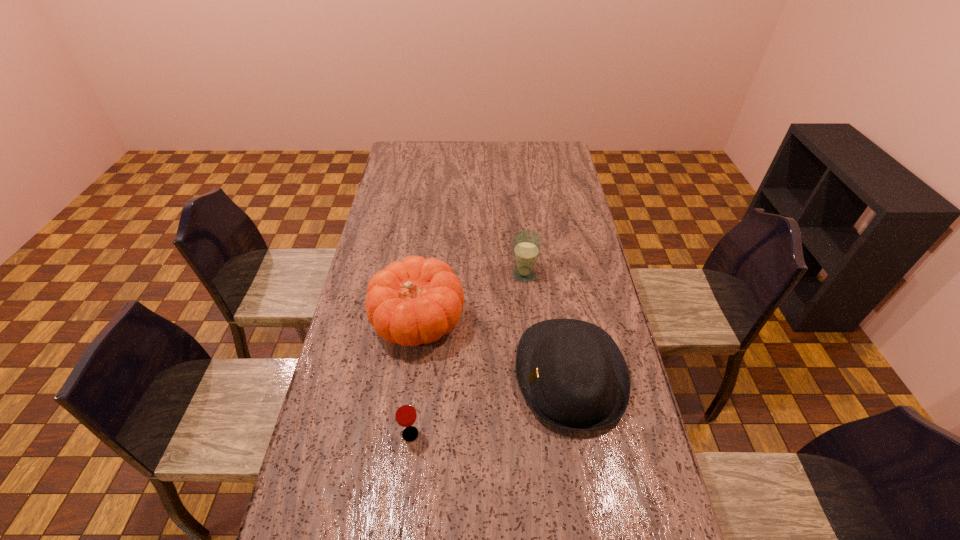
The width and height of the screenshot is (960, 540). Identify the location of the tallest object. tap(417, 301).

Locate an element on the screen. The width and height of the screenshot is (960, 540). the farther glass is located at coordinates (526, 244).

I want to click on the right glass, so click(x=526, y=244).

Find the location of a particular element. The height and width of the screenshot is (540, 960). fedora is located at coordinates (572, 374).

Where is `the nearer glass`? The image size is (960, 540). the nearer glass is located at coordinates [405, 413].

Where is `the shorter glass`? This screenshot has width=960, height=540. the shorter glass is located at coordinates (405, 413).

Where is `vacant space located 0.380m on the right of the tallest object`? The image size is (960, 540). vacant space located 0.380m on the right of the tallest object is located at coordinates (582, 322).

At what (x,y) coordinates should I click in order to perform the action: click on free space located on the back of the farther glass. Please return your answer as a coordinate pair (x, y). Looking at the image, I should click on (522, 252).

Image resolution: width=960 pixels, height=540 pixels. Identify the location of free spot located on the front-facing side of the fedora. (430, 375).

Image resolution: width=960 pixels, height=540 pixels. In order to click on free space located on the front-facing side of the fedora in this screenshot , I will do `click(470, 375)`.